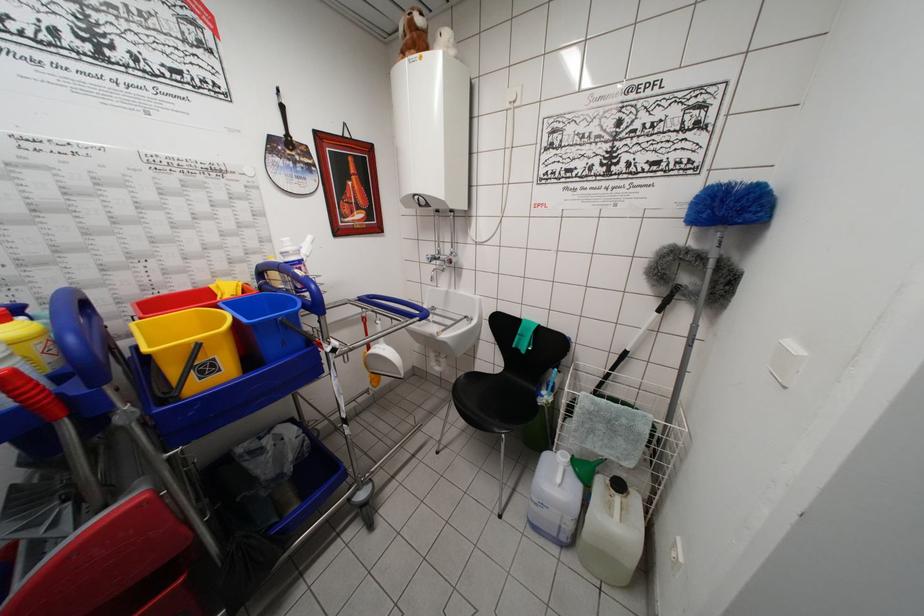
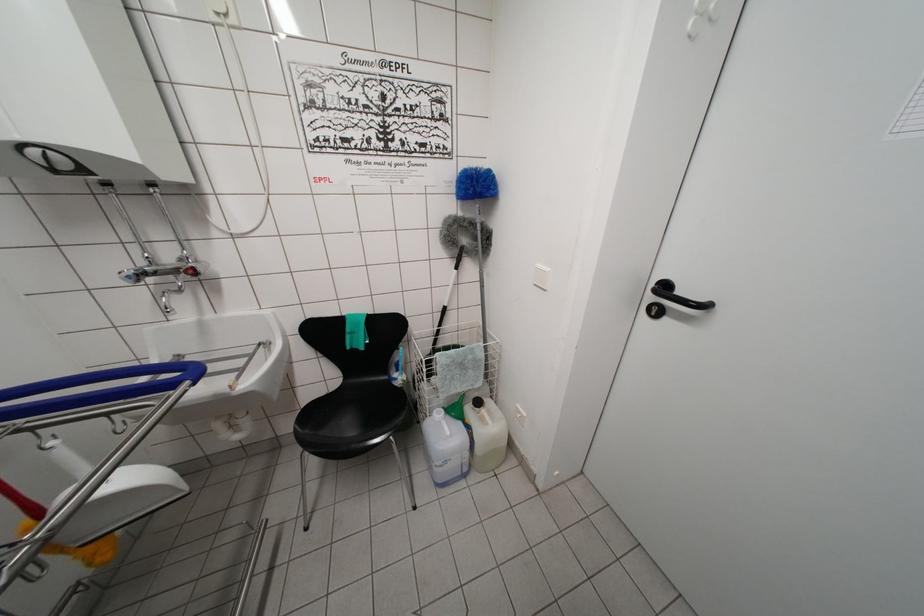
Find the pixel in the second image that matches pixel 453 262 in the first image.

(193, 270)